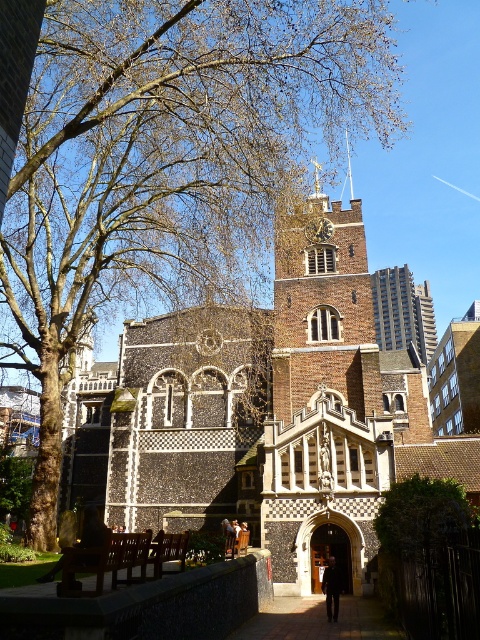
Question: Is brown brick tower at center to the left of smooth silver spire at upper center from the viewer's perspective?

Choices:
 (A) no
 (B) yes

Answer: (B)

Question: Among these objects, which one is nearest to the camera?

Choices:
 (A) smooth silver spire at upper center
 (B) gold textured clock at center
 (C) brick pathway at center

Answer: (C)

Question: In this image, where is brick pathway at center located relative to smooth silver spire at upper center?

Choices:
 (A) above
 (B) below

Answer: (B)

Question: Which point is farther to the camera?

Choices:
 (A) brick pathway at center
 (B) smooth silver spire at upper center
 (C) gold textured clock at center

Answer: (B)

Question: Can you confirm if brown brick tower at center is smaller than dark wool coat at center?

Choices:
 (A) no
 (B) yes

Answer: (A)

Question: Estimate the real-world distances between objects in this image. Which object is farther from the smooth silver spire at upper center?

Choices:
 (A) brick pathway at center
 (B) dark wool coat at center
 (C) brown brick tower at center
 (D) gold textured clock at center

Answer: (B)